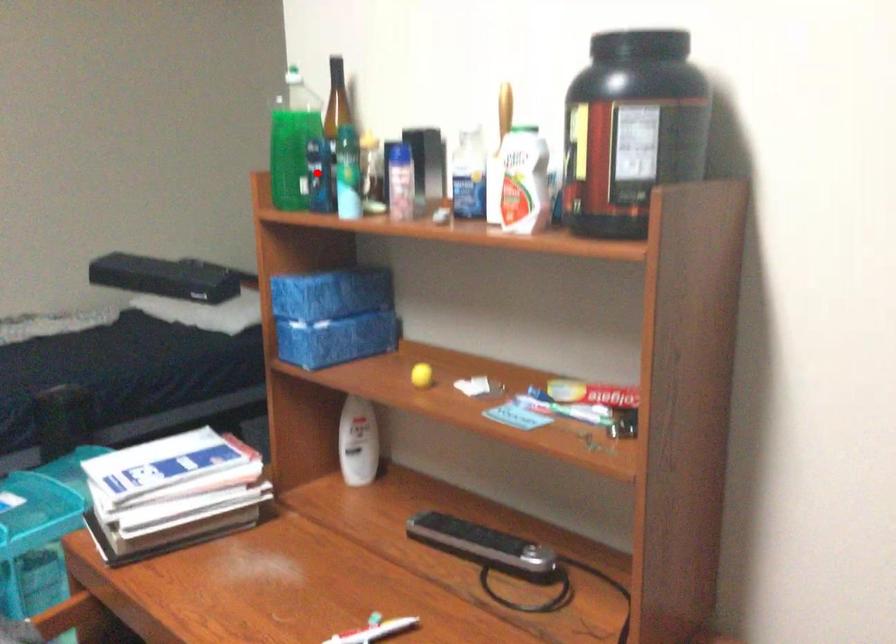
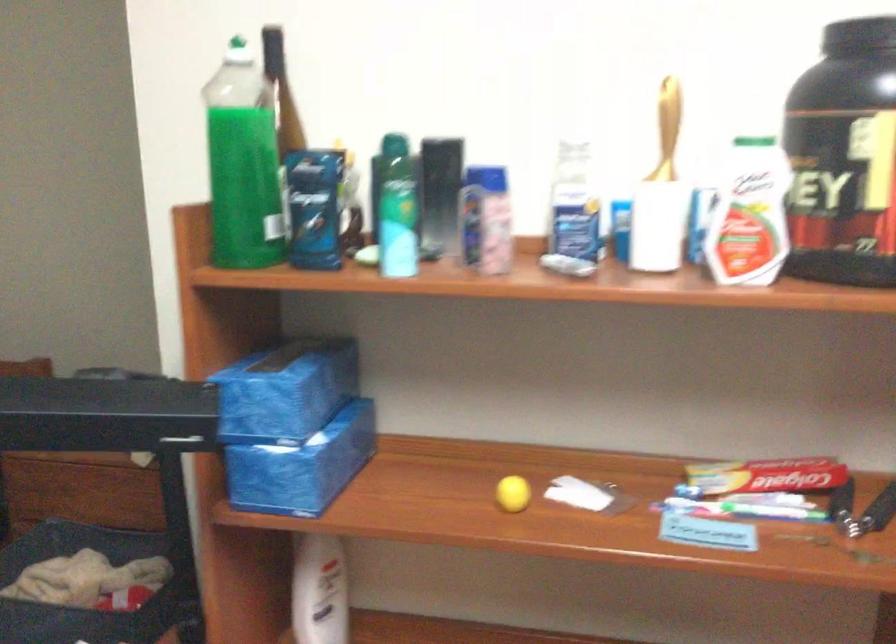
Question: I am providing you with two images of the same scene from different viewpoints. A red point is shown in image1. For the corresponding object point in image2, is it positioned nearer or farther from the camera?

Choices:
 (A) Nearer
 (B) Farther

Answer: (A)